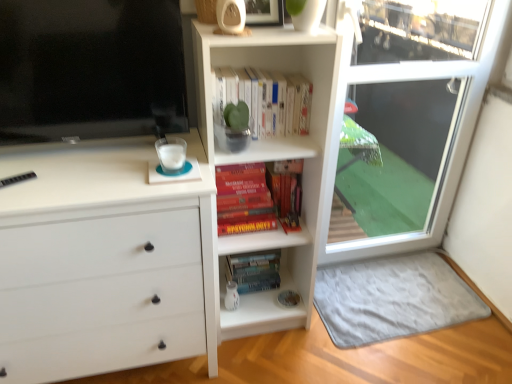
The image size is (512, 384). In order to click on free point below flat screen tv at upper left (from a real-world perspective) in this screenshot , I will do `click(94, 154)`.